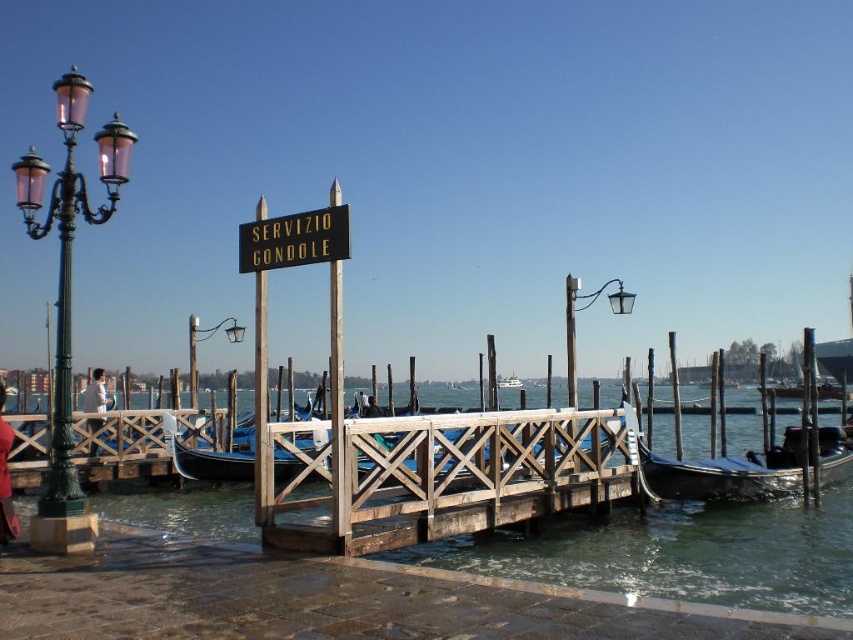
You are a tourist standing on the wooden dock and want to take a photo of the blue polished wood gondola at center. To ensure the clear water at dock center doesn t block your view, which direction should you move to get a better angle?

You should move to the left side of the blue polished wood gondola at center since the clear water at dock center is to its right, so moving left would position you where the water isn t obstructing the view.

You are a tourist standing on the wooden dock and want to take a photo of the blue polished wood gondola at center. However, you notice the green glass streetlamp at left is blocking your view. Can you move closer to the gondola to avoid the streetlamp blocking the shot?

The green glass streetlamp at left is closer to the viewer than the blue polished wood gondola at center, so moving closer to the gondola would bring it into a position where the streetlamp might still block the view unless you move sideways. Alternatively, stepping back could allow the gondola to appear behind the lamp, but this depends on the exact positioning.